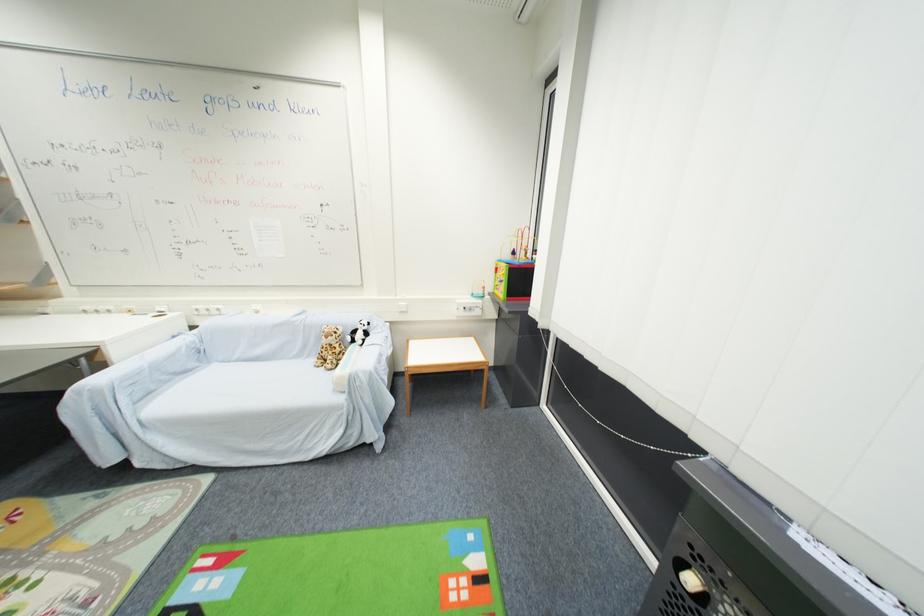
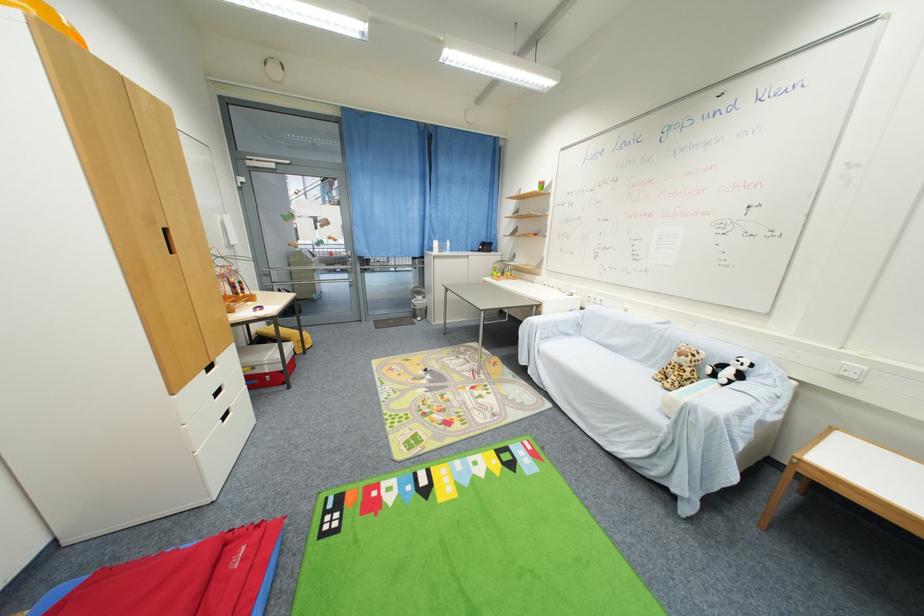
Question: I am providing you with two images of the same scene from different viewpoints. Which of the following objects are not visible in image2?

Choices:
 (A) red storage box
 (B) white drawer handle
 (C) stuffed panda toy
 (D) none of these

Answer: (D)